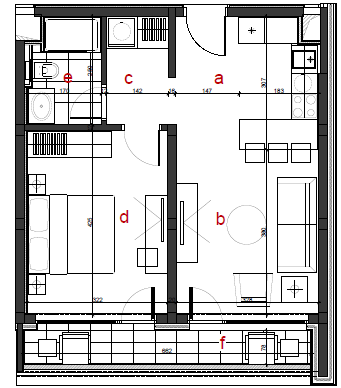
Find the location of a particular element. The width and height of the screenshot is (341, 388). bedroom is located at coordinates (120, 194).